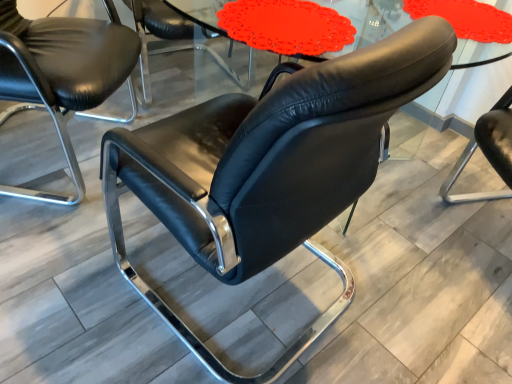
Identify the location of free space in front of black leather chair at left, arranged as the second chair when viewed from the front. This screenshot has height=384, width=512. (56, 268).